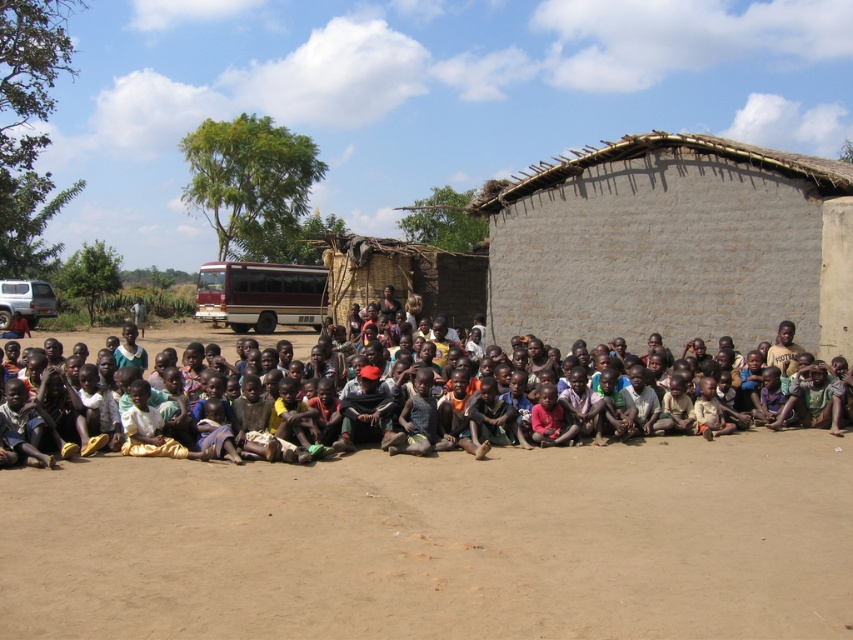
Image resolution: width=853 pixels, height=640 pixels. What do you see at coordinates (260, 294) in the screenshot?
I see `white matte school bus at upper left` at bounding box center [260, 294].

Who is positioned more to the left, white matte school bus at upper left or dark brown skin at center?

white matte school bus at upper left is more to the left.

Who is more forward, (286,320) or (70,337)?

Point (70,337) is more forward.

The height and width of the screenshot is (640, 853). I want to click on white matte school bus at upper left, so click(x=260, y=294).

Is brown sandy ground at center thinner than gray mud hut at right?

Yes, brown sandy ground at center is thinner than gray mud hut at right.

Can you confirm if brown sandy ground at center is shorter than gray mud hut at right?

Yes.

Measure the distance between brown sandy ground at center and camera.

brown sandy ground at center and camera are 13.16 feet apart.

This screenshot has width=853, height=640. In order to click on brown sandy ground at center in this screenshot , I will do `click(440, 544)`.

Does point (772, 563) come farther from viewer compared to point (303, 355)?

That is False.

What do you see at coordinates (440, 544) in the screenshot? I see `brown sandy ground at center` at bounding box center [440, 544].

The height and width of the screenshot is (640, 853). Find the location of `brown sandy ground at center`. brown sandy ground at center is located at coordinates (440, 544).